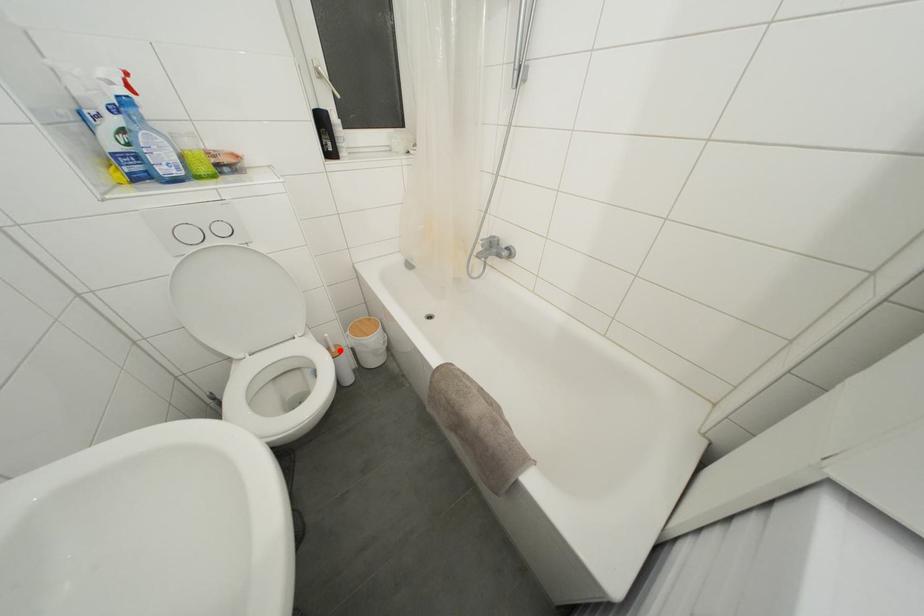
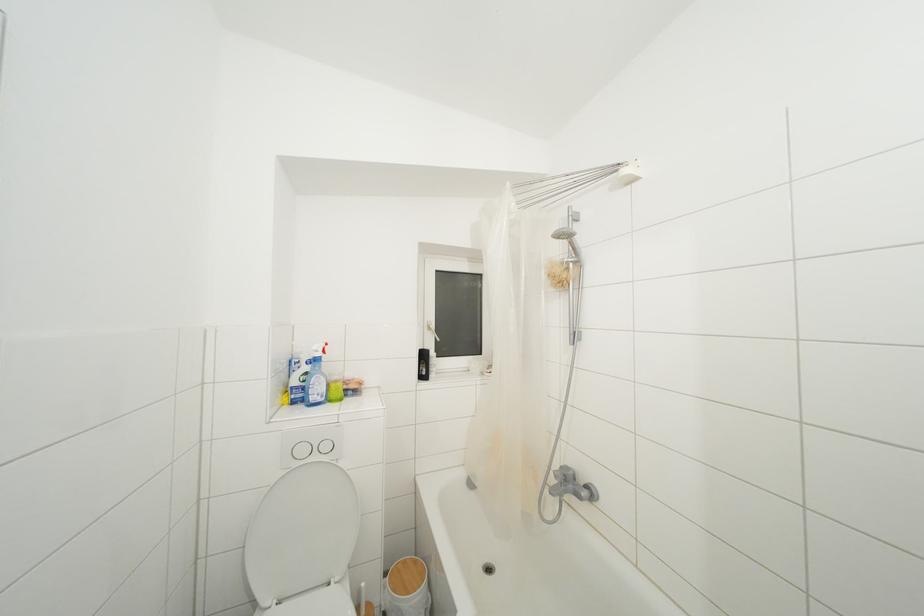
Locate, in the second image, the point that corresponds to the highlighted location in the first image.

(371, 610)